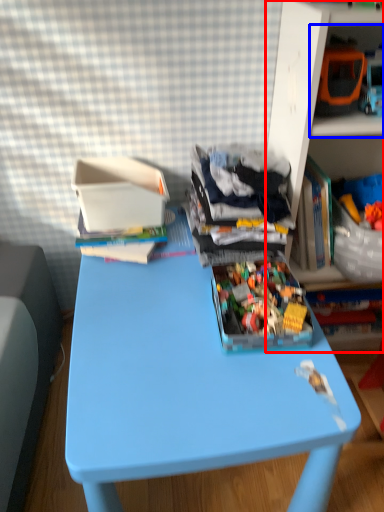
Question: Which object is further to the camera taking this photo, shelf (highlighted by a red box) or shelf (highlighted by a blue box)?

Choices:
 (A) shelf
 (B) shelf

Answer: (B)